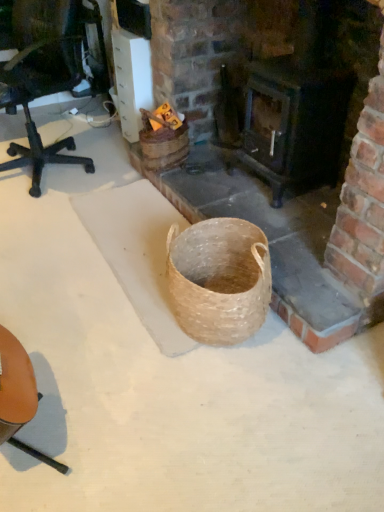
The width and height of the screenshot is (384, 512). Identify the location of vacant space to the right of brown leather chair at lower left. (120, 410).